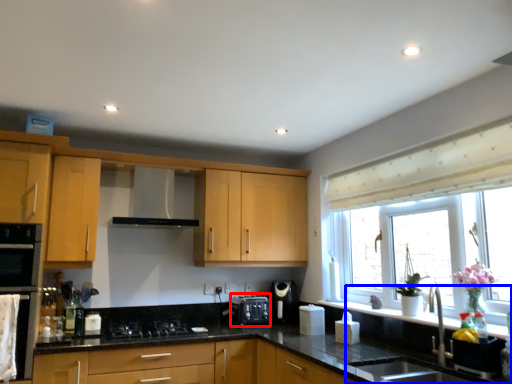
Question: Which of the following is the farthest to the observer, appliance (highlighted by a red box) or sink (highlighted by a blue box)?

Choices:
 (A) appliance
 (B) sink

Answer: (A)